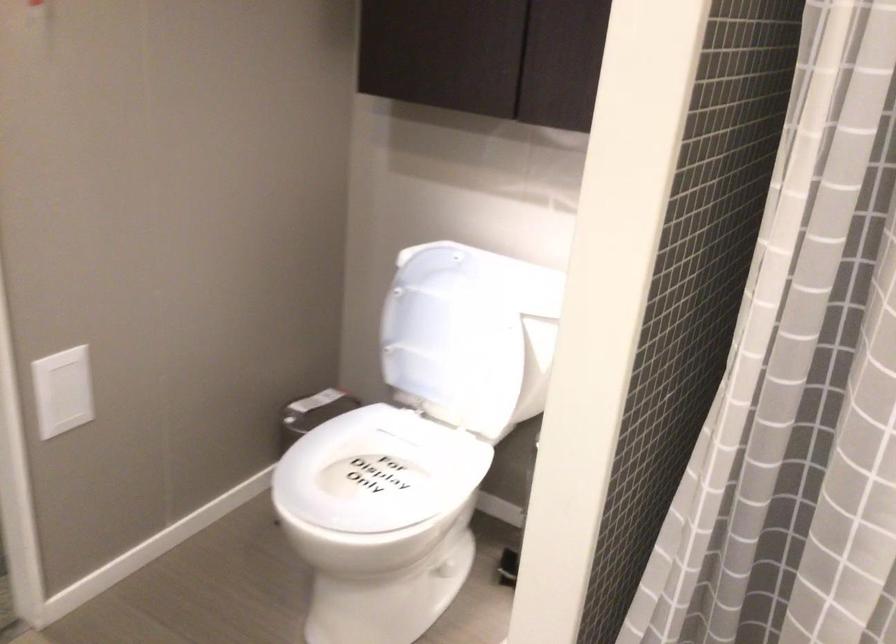
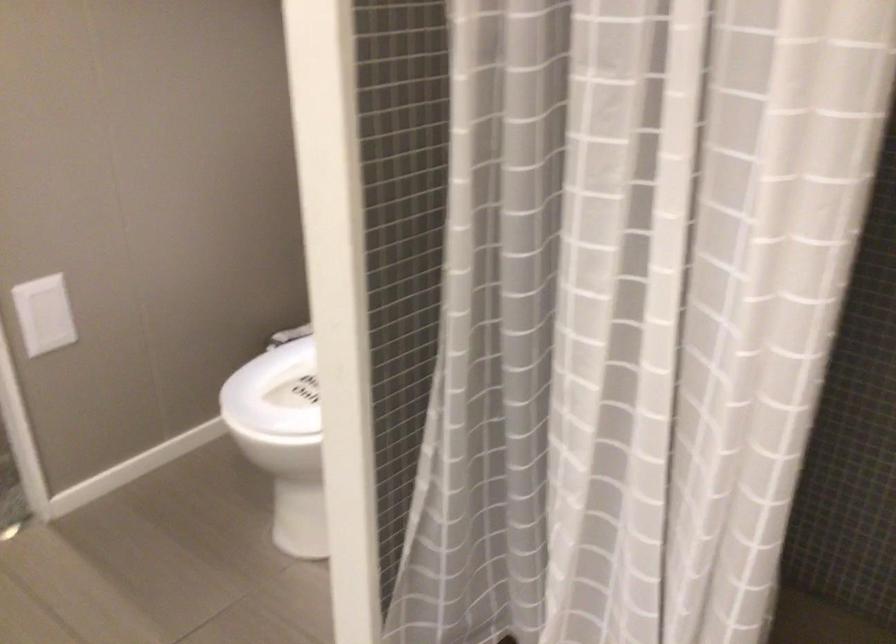
Question: I am providing you with two images of the same scene from different viewpoints. Which of the following objects are not visible in image2?

Choices:
 (A) white toilet seat
 (B) white toilet lid
 (C) white light switch
 (D) cabinet drawer key

Answer: (A)